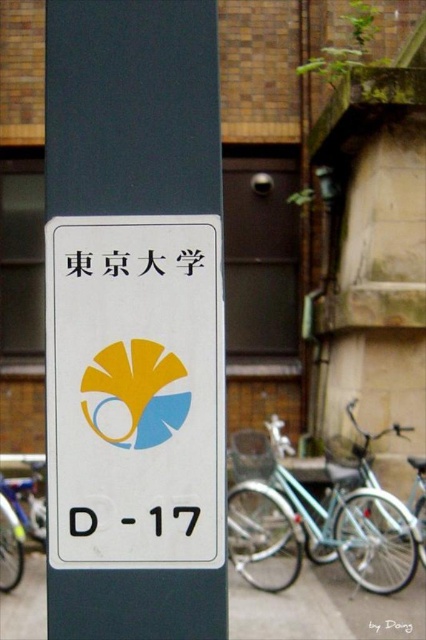
Is matte gray pole at center to the right of gray concrete pavement at lower center from the viewer's perspective?

In fact, matte gray pole at center is to the left of gray concrete pavement at lower center.

Between point (181, 92) and point (351, 611), which one is positioned in front?

Point (181, 92) is in front.

Identify the location of matte gray pole at center. (132, 106).

Does point (115, 253) lie in front of point (370, 632)?

Yes, it is in front of point (370, 632).

From the picture: Is black plastic sign at center wider than black paper at upper center?

No, black plastic sign at center is not wider than black paper at upper center.

Which is behind, point (155, 260) or point (402, 628)?

Positioned behind is point (402, 628).

The width and height of the screenshot is (426, 640). Find the location of `black plastic sign at center`. black plastic sign at center is located at coordinates (114, 262).

Does gray concrete pavement at lower center appear on the right side of black paper at upper center?

Incorrect, gray concrete pavement at lower center is not on the right side of black paper at upper center.

Who is positioned more to the right, gray concrete pavement at lower center or black paper at upper center?

black paper at upper center

Measure the distance between gray concrete pavement at lower center and camera.

gray concrete pavement at lower center is 5.54 meters away from camera.

This screenshot has height=640, width=426. Identify the location of gray concrete pavement at lower center. (319, 605).